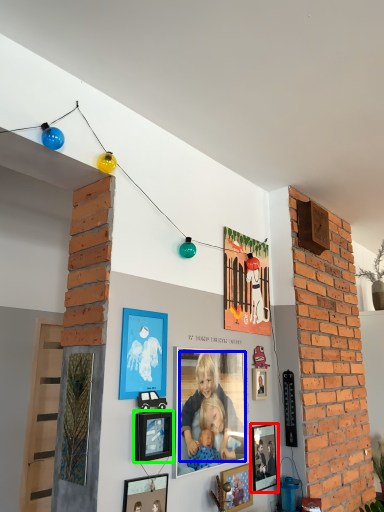
Question: Which object is positioned closest to picture frame (highlighted by a red box)? Select from person (highlighted by a blue box) and picture frame (highlighted by a green box).

Choices:
 (A) person
 (B) picture frame

Answer: (A)